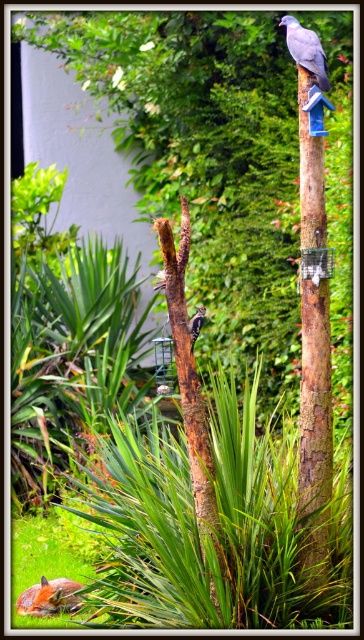
Question: Which object is farther from the camera taking this photo?

Choices:
 (A) brown speckled woodpecker at center
 (B) matte gray pigeon at upper center
 (C) gray matte bird at upper right
 (D) brown rough wood pole at upper right

Answer: (B)

Question: Does matte gray pigeon at upper center have a lesser width compared to gray matte bird at upper right?

Choices:
 (A) no
 (B) yes

Answer: (A)

Question: Can you confirm if brown rough bark at center is positioned above gray matte bird at upper right?

Choices:
 (A) no
 (B) yes

Answer: (A)

Question: Among these points, which one is farthest from the camera?

Choices:
 (A) (203, 317)
 (B) (171, 326)

Answer: (A)

Question: Can you confirm if brown rough wood pole at upper right is wider than matte gray pigeon at upper center?

Choices:
 (A) yes
 (B) no

Answer: (B)

Question: Estimate the real-world distances between objects in this image. Which object is farther from the matte gray pigeon at upper center?

Choices:
 (A) brown rough bark at center
 (B) gray matte bird at upper right

Answer: (B)